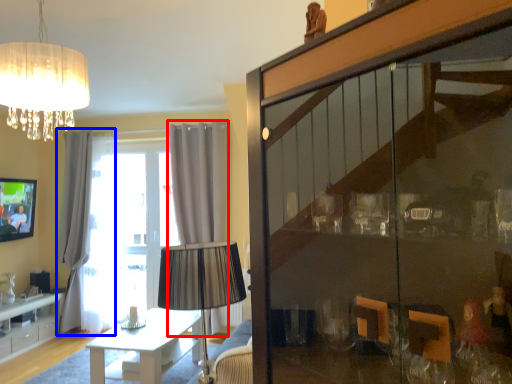
Question: Which object appears farthest to the camera in this image, curtain (highlighted by a red box) or curtain (highlighted by a blue box)?

Choices:
 (A) curtain
 (B) curtain

Answer: (B)